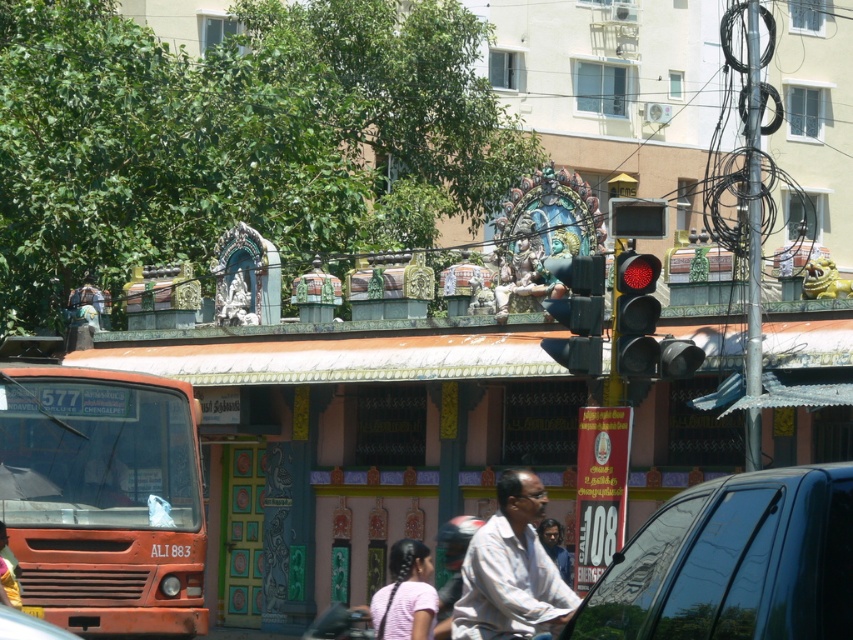
Question: Which object appears closest to the camera in this image?

Choices:
 (A) pink fabric hair at center
 (B) matte orange bus at left
 (C) shiny black car at center
 (D) light brown skin at center

Answer: (C)

Question: Is metallic black traffic light at center closer to the viewer compared to light pink fabric at lower center?

Choices:
 (A) yes
 (B) no

Answer: (B)

Question: Which object is positioned farthest from the light brown skin at center?

Choices:
 (A) white cotton shirt at center
 (B) light pink fabric at lower center
 (C) matte orange bus at left
 (D) metallic orange truck at lower left

Answer: (D)

Question: Can you confirm if matte orange bus at left is positioned above shiny black car at center?

Choices:
 (A) yes
 (B) no

Answer: (B)

Question: Does white cotton shirt at center have a greater width compared to pink fabric hair at center?

Choices:
 (A) yes
 (B) no

Answer: (B)

Question: Among these objects, which one is farthest from the camera?

Choices:
 (A) metallic orange truck at lower left
 (B) metallic black traffic light at center
 (C) matte orange bus at left
 (D) white cotton shirt at center

Answer: (B)